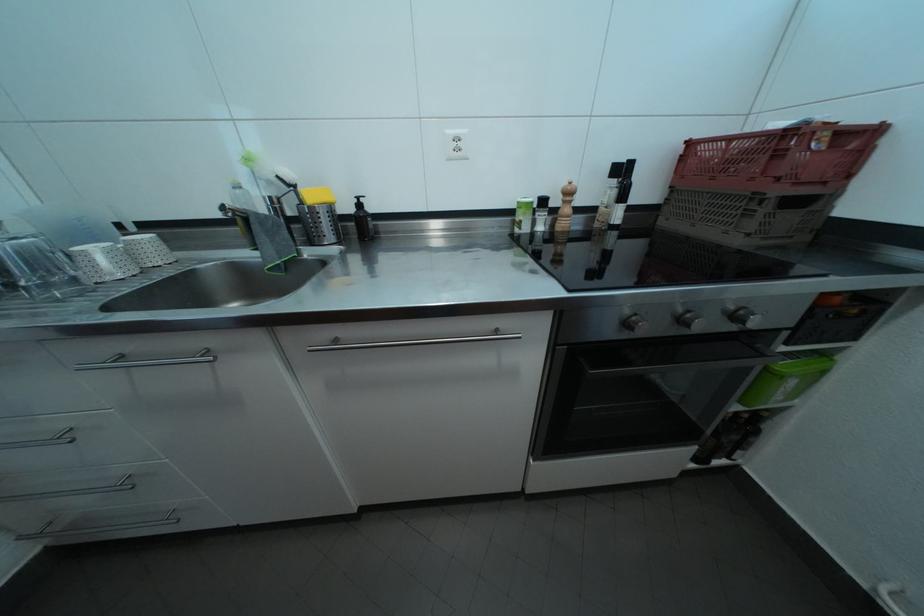
Find where to lift the green plastic bin. Please return your answer as a coordinate pair (x, y).

(785, 379)